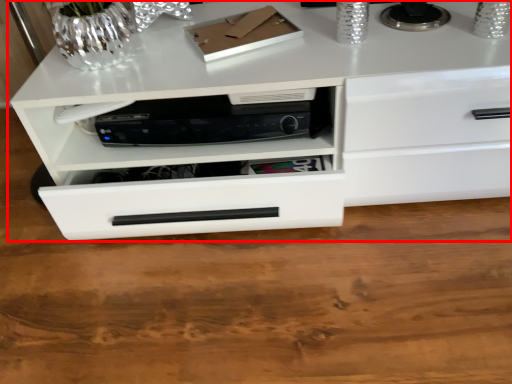
Question: From the image's perspective, what is the correct spatial relationship of chest of drawers (annotated by the red box) in relation to home appliance?

Choices:
 (A) below
 (B) above

Answer: (B)